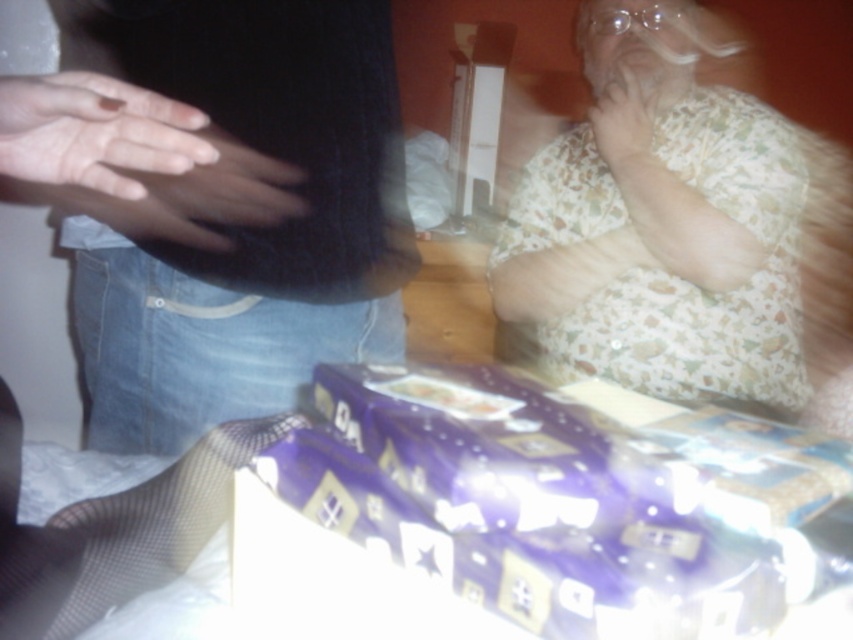
Question: Does floral-patterned fabric at upper right have a lesser width compared to matte skin hand at left?

Choices:
 (A) yes
 (B) no

Answer: (B)

Question: Which of the following is the farthest from the observer?

Choices:
 (A) floral-patterned fabric at upper right
 (B) floral cotton shirt at upper right
 (C) matte skin hand at left
 (D) matte black hand at left

Answer: (A)

Question: Does floral cotton shirt at upper right come in front of matte black hand at left?

Choices:
 (A) no
 (B) yes

Answer: (B)

Question: Which of the following is the farthest from the observer?

Choices:
 (A) (198, 192)
 (B) (790, 372)
 (C) (199, 76)
 (D) (0, 108)

Answer: (B)

Question: Can you confirm if floral-patterned fabric at upper right is positioned to the right of matte skin hand at upper right?

Choices:
 (A) yes
 (B) no

Answer: (A)

Question: Which of the following is the closest to the observer?

Choices:
 (A) floral cotton shirt at upper right
 (B) floral-patterned fabric at upper right
 (C) matte skin hand at left

Answer: (C)